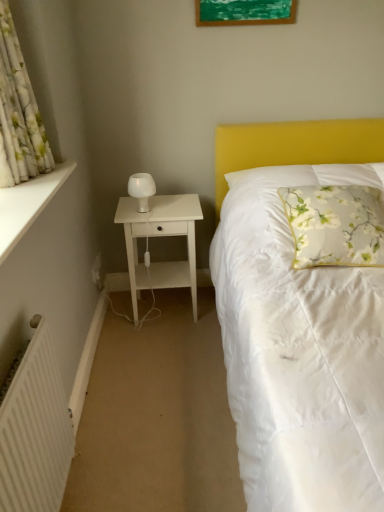
Locate an element on the screen. The height and width of the screenshot is (512, 384). vacant space in front of white frosted glass lamp at left is located at coordinates (149, 216).